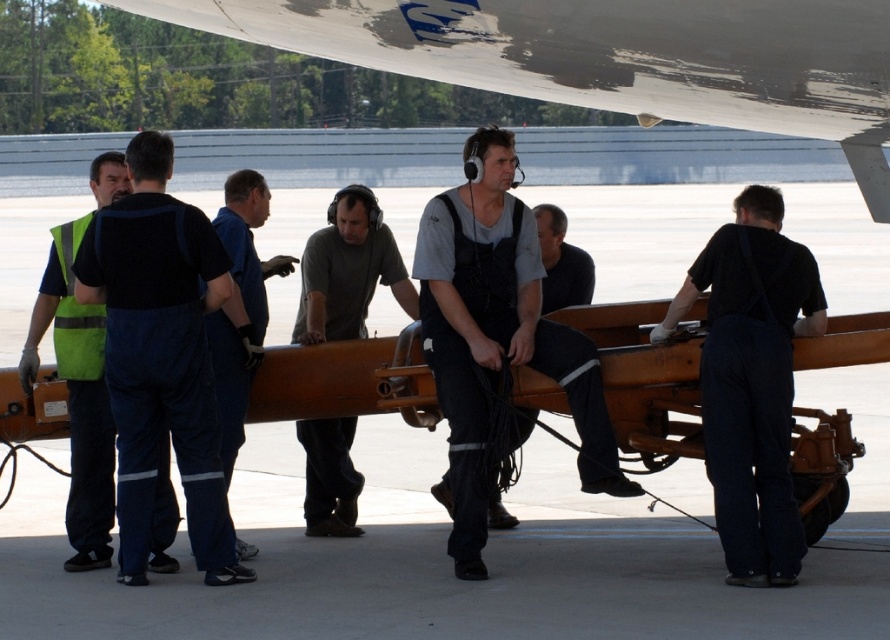
You are a technician standing at the origin point of a coordinate system placed at the bottom left corner of the image. You need to locate the reflective green vest at left. What are its coordinates?

The coordinates of the reflective green vest at left are at point (77, 397).

From the picture: You are an airport security officer checking the visibility of workers on the tarmac. You notice the reflective green vest at left and the dark gray fabric shirt at center. Which clothing item is taller in the image?

The reflective green vest at left is taller than the dark gray fabric shirt at center.